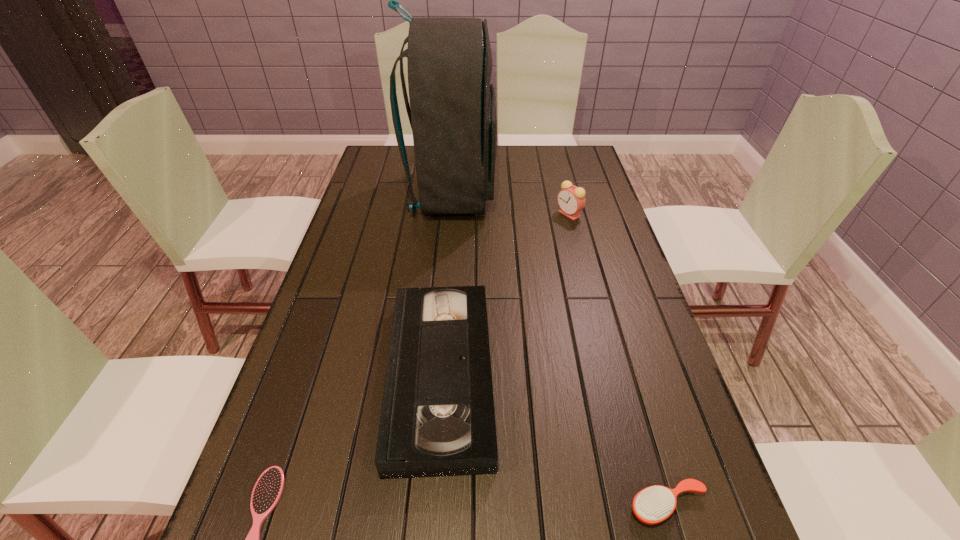
Image resolution: width=960 pixels, height=540 pixels. What are the coordinates of `backpack` in the screenshot? It's located at tap(452, 112).

What are the coordinates of `the fourth shortest object` in the screenshot? It's located at (571, 199).

Where is `the third tallest object`? Image resolution: width=960 pixels, height=540 pixels. the third tallest object is located at coordinates (437, 419).

Identify the location of the fourth tallest object. The width and height of the screenshot is (960, 540). (654, 504).

The image size is (960, 540). I want to click on the taller hairbrush, so click(x=654, y=504).

Find the location of a particular element. Image resolution: width=960 pixels, height=540 pixels. free location located 0.110m on the front-facing side of the tallest object is located at coordinates (527, 194).

This screenshot has width=960, height=540. I want to click on vacant space situated 0.200m on the face of the fourth shortest object, so click(496, 214).

The height and width of the screenshot is (540, 960). I want to click on free spot located 0.400m on the face of the fourth shortest object, so click(436, 214).

Where is `vacant area located 0.160m on the face of the fourth shortest object`? Image resolution: width=960 pixels, height=540 pixels. vacant area located 0.160m on the face of the fourth shortest object is located at coordinates 508,214.

Locate an element on the screen. This screenshot has width=960, height=540. vacant space positioned 0.090m on the front of the videotape is located at coordinates (429, 532).